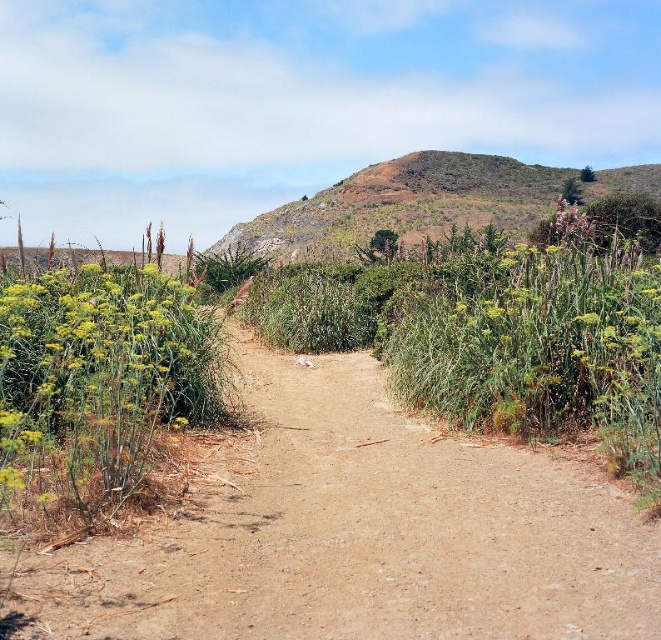
In the scene shown: You are planning to take a photo of the green leafy plant at left and the green grassy hillside at upper center. Which of the two objects will appear smaller in the photo?

The green leafy plant at left will appear smaller in the photo because it occupies less space than the green grassy hillside at upper center.

You are a hiker planning to walk along the brown dirt track at center and the green grassy hillside at upper center. Which of these two features is shorter in height?

The brown dirt track at center is not as tall as the green grassy hillside at upper center, so the brown dirt track at center is shorter in height.